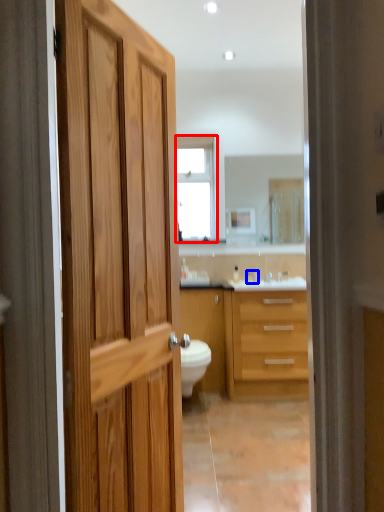
Question: Which of the following is the farthest to the observer, window (highlighted by a red box) or faucet (highlighted by a blue box)?

Choices:
 (A) window
 (B) faucet

Answer: (A)